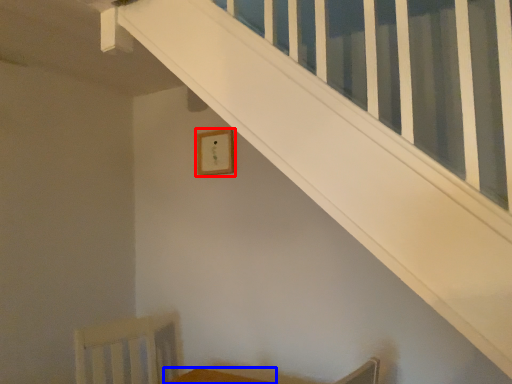
Question: Which of the following is the closest to the observer, picture frame (highlighted by a red box) or furniture (highlighted by a blue box)?

Choices:
 (A) picture frame
 (B) furniture

Answer: (B)